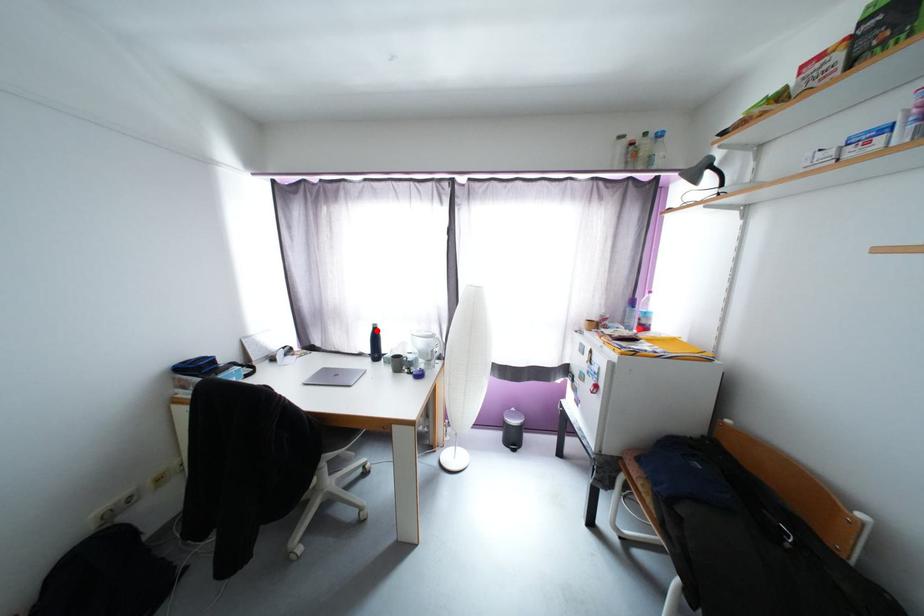
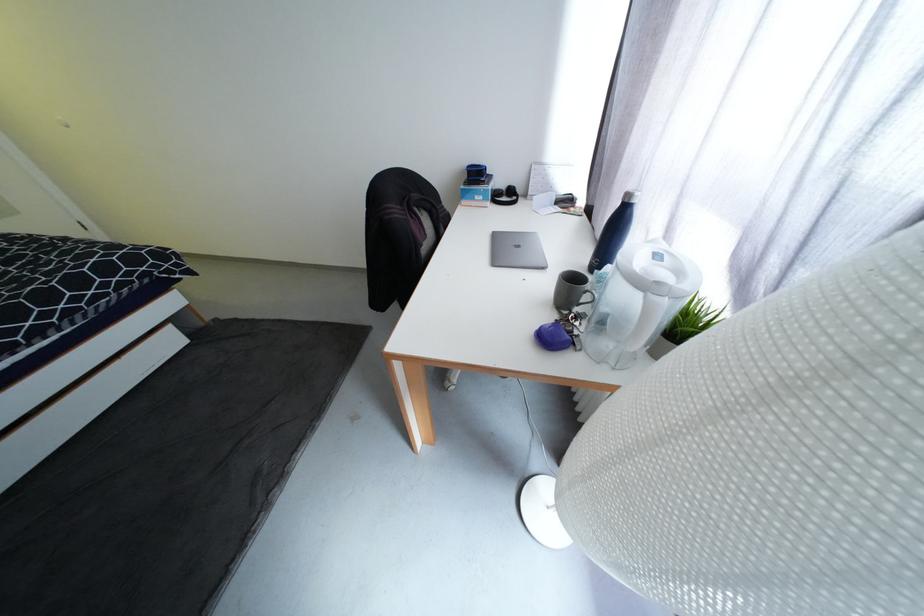
The point at the highlighted location is marked in the first image. Where is the corresponding point in the second image?

(626, 205)